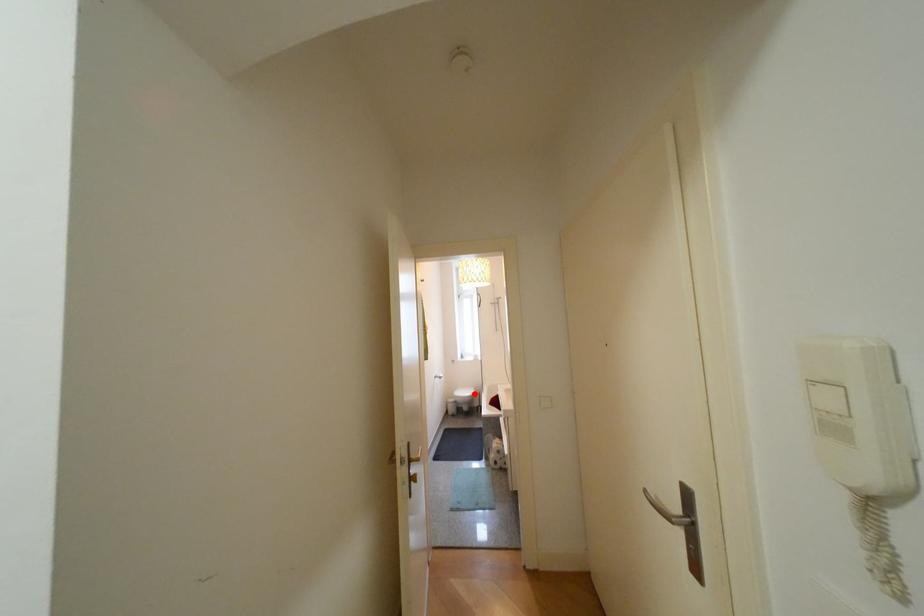
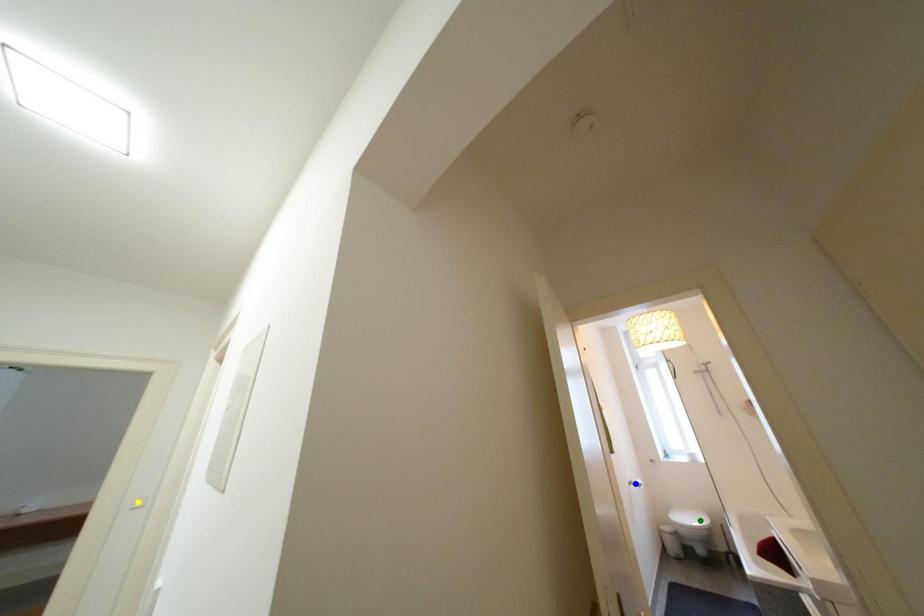
Question: I am providing you with two images of the same scene from different viewpoints. A red point is marked on the first image. You are given multiple points on the second image. Which point in image 2 represents the same 3d spot as the red point in image 1?

Choices:
 (A) blue point
 (B) yellow point
 (C) green point

Answer: (C)